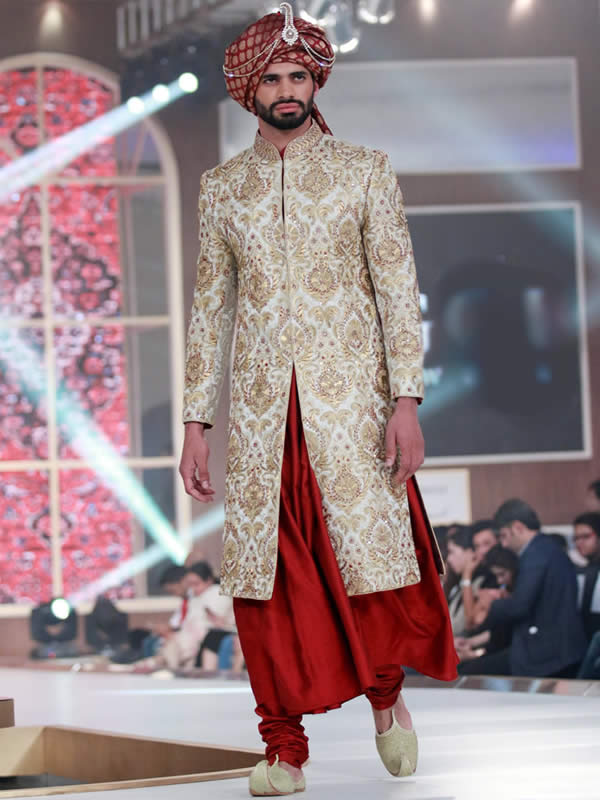
Locate an element on the screen. This screenshot has height=800, width=600. coat is located at coordinates (320, 326).